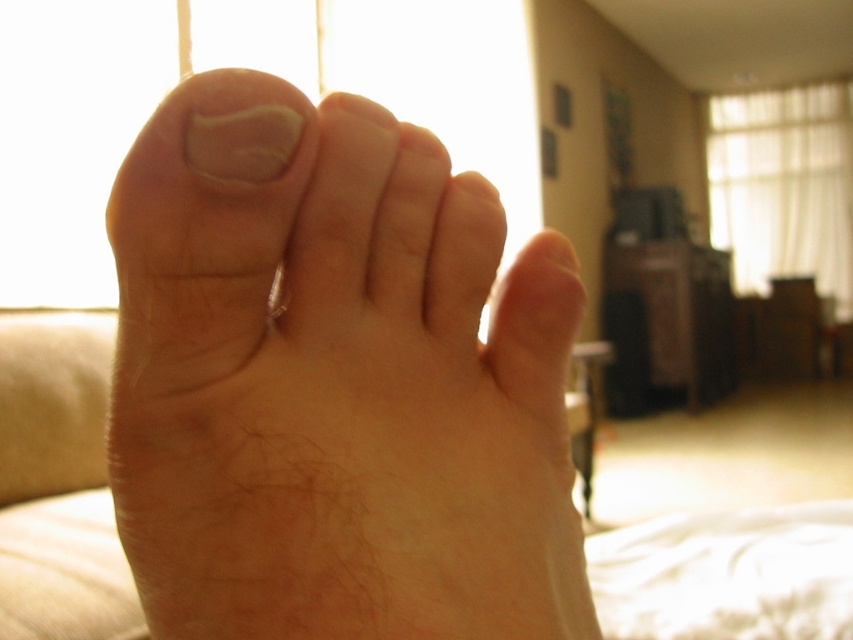
Where is the pale skin foot at center located in the image?

The pale skin foot at center is located at point (x=334, y=381) in the image.